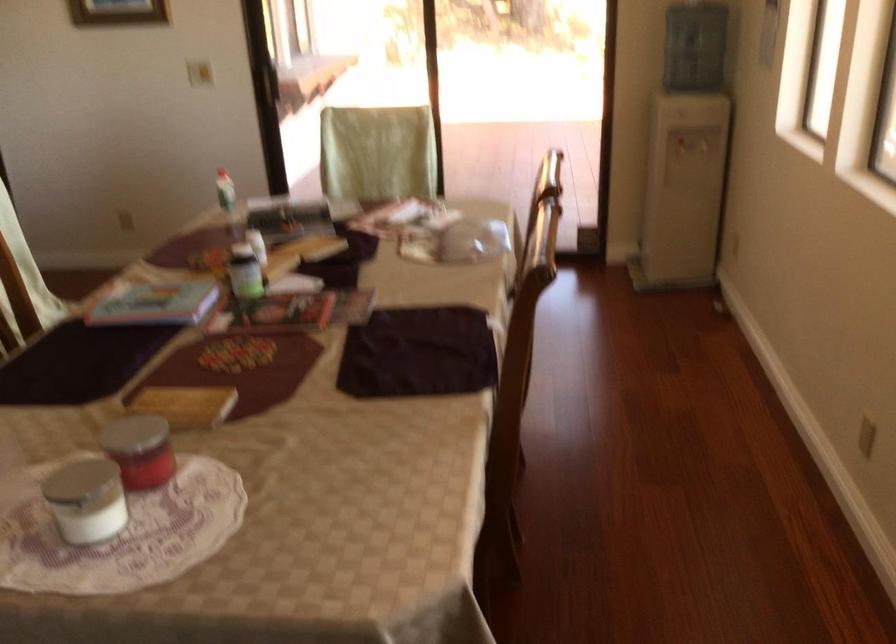
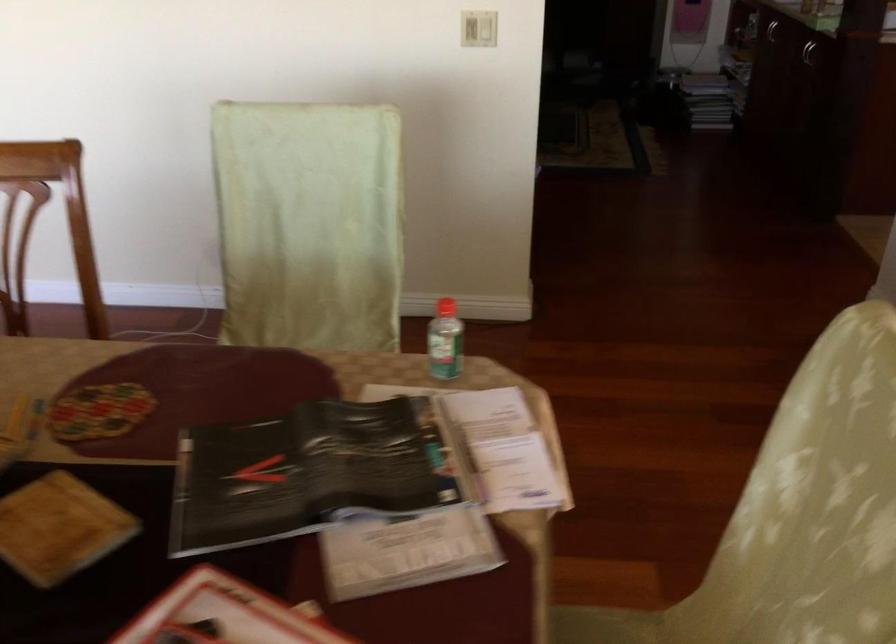
Where in the second image is the point corresponding to (x=227, y=185) from the first image?

(444, 341)